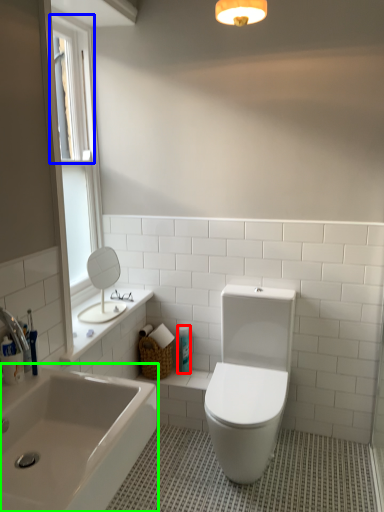
Question: Which is nearer to the toiletry (highlighted by a red box)? window screen (highlighted by a blue box) or bathtub (highlighted by a green box).

Choices:
 (A) window screen
 (B) bathtub

Answer: (B)